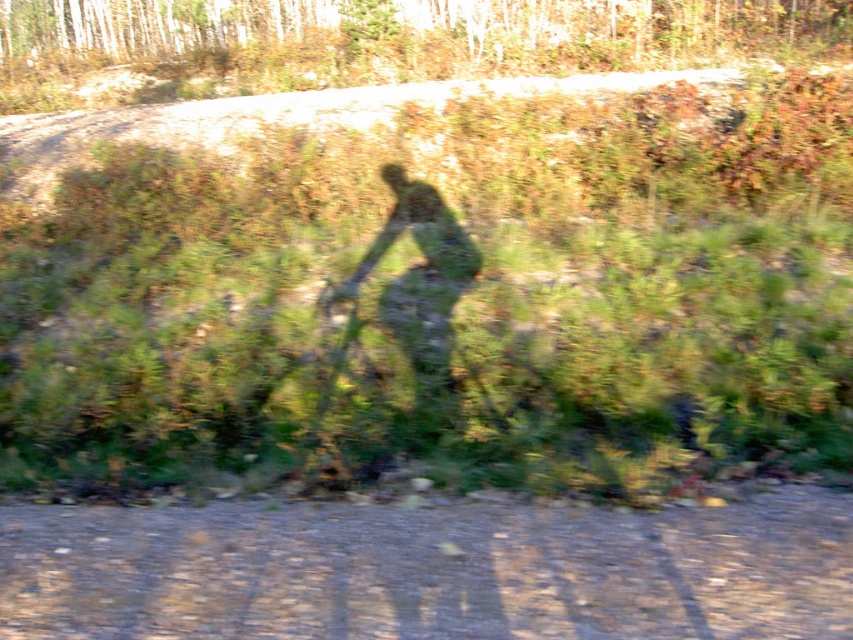
Question: Which object is positioned closest to the green leafy grass at center?

Choices:
 (A) green matte figure at center
 (B) brown gravel dirt track at lower center

Answer: (A)

Question: Is green leafy grass at center to the left of green matte figure at center from the viewer's perspective?

Choices:
 (A) yes
 (B) no

Answer: (A)

Question: Which is farther from the green matte figure at center?

Choices:
 (A) green leafy grass at center
 (B) brown gravel dirt track at lower center

Answer: (B)

Question: Where is brown gravel dirt track at lower center located in relation to green matte figure at center in the image?

Choices:
 (A) left
 (B) right

Answer: (B)

Question: Among these objects, which one is farthest from the camera?

Choices:
 (A) green matte figure at center
 (B) green leafy grass at center
 (C) brown gravel dirt track at lower center

Answer: (A)

Question: Is green leafy grass at center closer to the viewer compared to brown gravel dirt track at lower center?

Choices:
 (A) yes
 (B) no

Answer: (B)